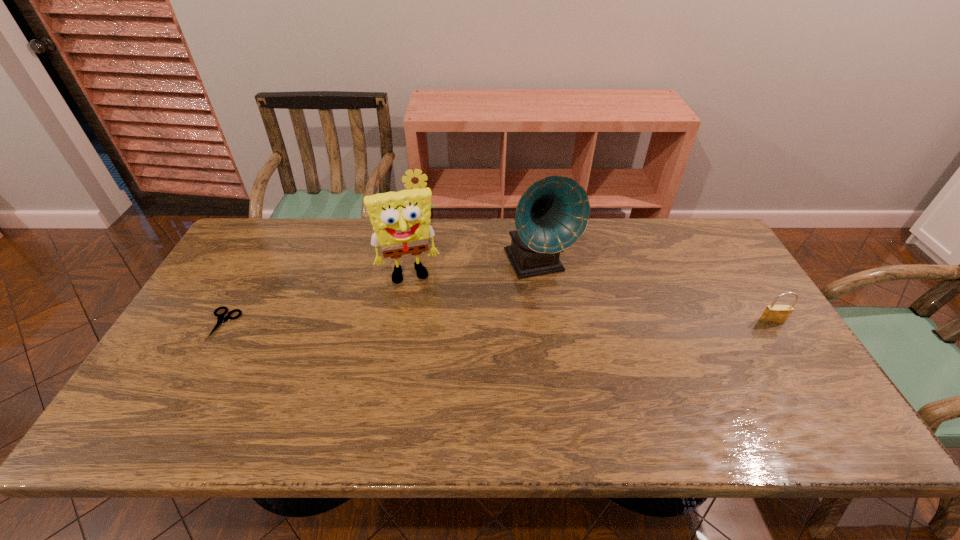
Where is `free space on the desktop that is between the shortest object and the rightmost object and is positioned from the horn of the phonograph_record`? Image resolution: width=960 pixels, height=540 pixels. free space on the desktop that is between the shortest object and the rightmost object and is positioned from the horn of the phonograph_record is located at coordinates (571, 322).

At what (x,y) coordinates should I click in order to perform the action: click on free space on the desktop that is between the shears and the padlock and is positioned on the front-facing side of the farthest object. Please return your answer as a coordinate pair (x, y). The width and height of the screenshot is (960, 540). Looking at the image, I should click on (420, 323).

You are a GUI agent. You are given a task and a screenshot of the screen. Output one action in this format:
    pyautogui.click(x=<x>, y=<y>)
    Task: Click on the free spot on the desktop that is between the leftmost object and the padlock and is positioned on the face of the sponge
    
    Given the screenshot: What is the action you would take?
    pyautogui.click(x=419, y=323)